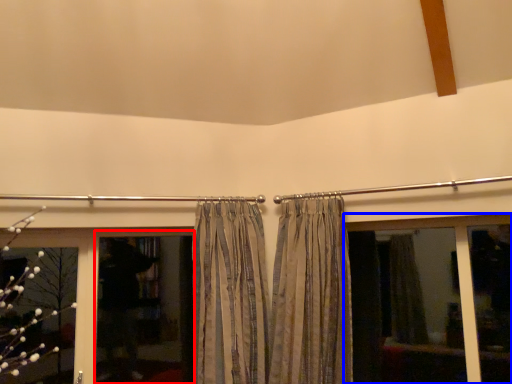
Question: Which object appears farthest to the camera in this image, screen door (highlighted by a red box) or window (highlighted by a blue box)?

Choices:
 (A) screen door
 (B) window

Answer: (A)